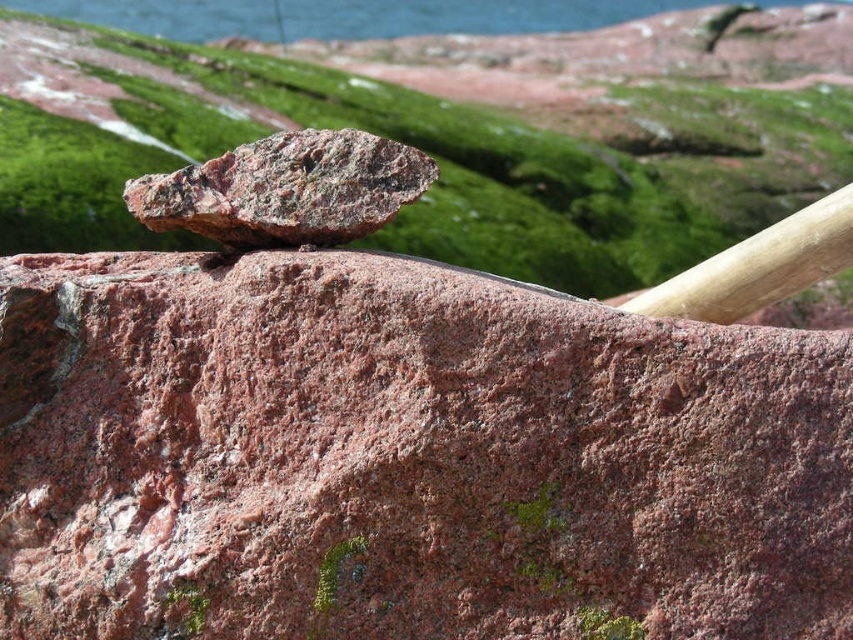
Does point (175, 220) come closer to viewer compared to point (517, 17)?

Yes, point (175, 220) is in front of point (517, 17).

Is rusty metallic rock at center smaller than blue water at upper center?

Indeed, rusty metallic rock at center has a smaller size compared to blue water at upper center.

At what (x,y) coordinates should I click in order to perform the action: click on rusty metallic rock at center. Please return your answer as a coordinate pair (x, y). This screenshot has height=640, width=853. Looking at the image, I should click on (286, 189).

Locate an element on the screen. The image size is (853, 640). rusty metallic rock at center is located at coordinates (286, 189).

Between rusty granite rock at center and rusty metallic rock at center, which one has more height?

rusty granite rock at center is taller.

Does rusty granite rock at center have a lesser height compared to rusty metallic rock at center?

No, rusty granite rock at center is not shorter than rusty metallic rock at center.

Which is in front, point (798, 348) or point (338, 221)?

Positioned in front is point (798, 348).

The height and width of the screenshot is (640, 853). Find the location of `rusty granite rock at center`. rusty granite rock at center is located at coordinates (404, 458).

From the picture: Who is lower down, rusty granite rock at center or blue water at upper center?

Positioned lower is rusty granite rock at center.

Can you confirm if rusty granite rock at center is taller than blue water at upper center?

Indeed, rusty granite rock at center has a greater height compared to blue water at upper center.

Does point (738, 573) come in front of point (444, 17)?

Yes, it is.

Where is `rusty granite rock at center`? The image size is (853, 640). rusty granite rock at center is located at coordinates (404, 458).